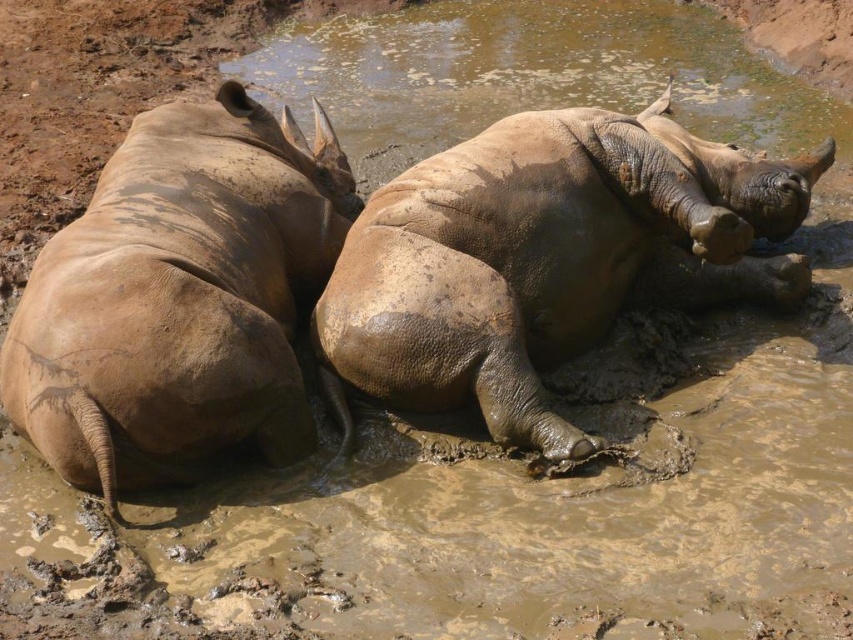
Question: Is dull brown rhinoceros at center to the right of dull brown rhino at left from the viewer's perspective?

Choices:
 (A) yes
 (B) no

Answer: (A)

Question: Which of the following is the farthest from the observer?

Choices:
 (A) (122, 243)
 (B) (515, 200)

Answer: (B)

Question: Can you confirm if dull brown rhinoceros at center is positioned below dull brown rhino at left?

Choices:
 (A) no
 (B) yes

Answer: (A)

Question: Can you confirm if dull brown rhinoceros at center is positioned below dull brown rhino at left?

Choices:
 (A) yes
 (B) no

Answer: (B)